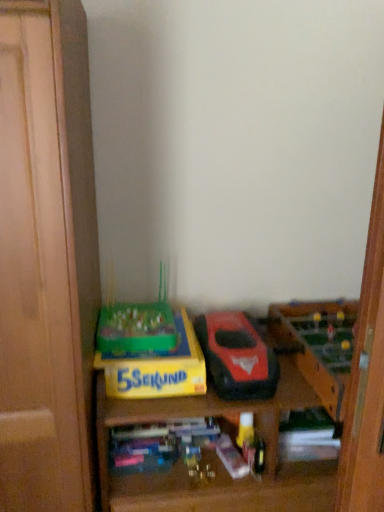
Question: From a real-world perspective, does wooden foosball table at right, the 2th toy viewed from the left, stand above green plastic game at center, positioned as the second toy in right-to-left order?

Choices:
 (A) no
 (B) yes

Answer: (A)

Question: Is wooden foosball table at right, marked as the first toy in a right-to-left arrangement, touching green plastic game at center, which is the first toy in left-to-right order?

Choices:
 (A) no
 (B) yes

Answer: (A)

Question: Does wooden foosball table at right, the 2th toy viewed from the left, have a greater width compared to green plastic game at center, positioned as the second toy in right-to-left order?

Choices:
 (A) no
 (B) yes

Answer: (B)

Question: Is wooden foosball table at right, marked as the first toy in a right-to-left arrangement, looking in the opposite direction of green plastic game at center, which is the first toy in left-to-right order?

Choices:
 (A) yes
 (B) no

Answer: (B)

Question: Is wooden foosball table at right, marked as the first toy in a right-to-left arrangement, positioned far away from green plastic game at center, which is the first toy in left-to-right order?

Choices:
 (A) yes
 (B) no

Answer: (B)

Question: Is wooden foosball table at right, marked as the first toy in a right-to-left arrangement, to the right of green plastic game at center, which is the first toy in left-to-right order, from the viewer's perspective?

Choices:
 (A) yes
 (B) no

Answer: (A)

Question: From the image's perspective, does shiny red plastic toy car at center appear higher than green plastic game at center, which is the first toy in left-to-right order?

Choices:
 (A) yes
 (B) no

Answer: (B)

Question: Does shiny red plastic toy car at center have a lesser height compared to green plastic game at center, positioned as the second toy in right-to-left order?

Choices:
 (A) no
 (B) yes

Answer: (B)

Question: Considering the relative sizes of shiny red plastic toy car at center and green plastic game at center, positioned as the second toy in right-to-left order, in the image provided, is shiny red plastic toy car at center wider than green plastic game at center, positioned as the second toy in right-to-left order,?

Choices:
 (A) yes
 (B) no

Answer: (A)

Question: Considering the relative positions of shiny red plastic toy car at center and green plastic game at center, positioned as the second toy in right-to-left order, in the image provided, is shiny red plastic toy car at center to the left of green plastic game at center, positioned as the second toy in right-to-left order, from the viewer's perspective?

Choices:
 (A) yes
 (B) no

Answer: (B)

Question: Is shiny red plastic toy car at center not inside green plastic game at center, positioned as the second toy in right-to-left order?

Choices:
 (A) no
 (B) yes

Answer: (B)

Question: Is there a large distance between shiny red plastic toy car at center and green plastic game at center, positioned as the second toy in right-to-left order?

Choices:
 (A) no
 (B) yes

Answer: (A)

Question: Does shiny red plastic toy car at center lie behind yellow cardboard box at lower center?

Choices:
 (A) yes
 (B) no

Answer: (B)